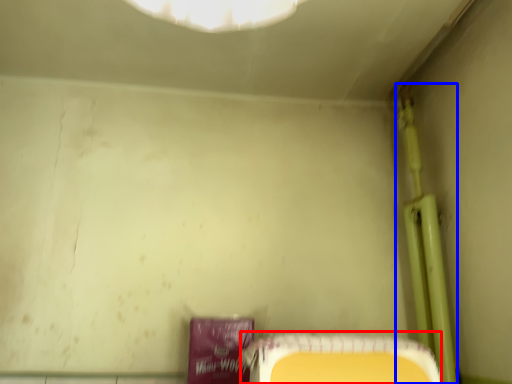
Question: Among these objects, which one is nearest to the camera, furniture (highlighted by a red box) or pipe (highlighted by a blue box)?

Choices:
 (A) furniture
 (B) pipe

Answer: (A)